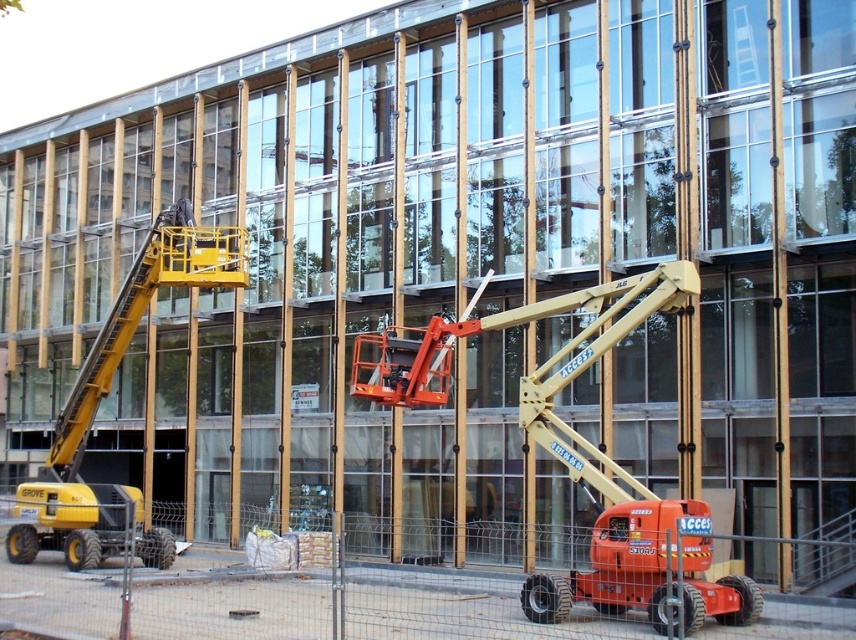
Question: Which of the following is the farthest from the observer?

Choices:
 (A) yellow metallic cherry picker at left
 (B) yellow rubber construction vehicle at lower left

Answer: (A)

Question: Can you confirm if orange metallic lift at center is positioned to the right of yellow metallic cherry picker at left?

Choices:
 (A) yes
 (B) no

Answer: (A)

Question: Is the position of yellow rubber construction vehicle at lower left less distant than that of orange metallic lift at center?

Choices:
 (A) yes
 (B) no

Answer: (A)

Question: Estimate the real-world distances between objects in this image. Which object is farther from the yellow rubber construction vehicle at lower left?

Choices:
 (A) orange metallic lift at center
 (B) yellow metallic cherry picker at left

Answer: (A)

Question: Which point appears farthest from the camera in this image?

Choices:
 (A) (114, 340)
 (B) (619, 608)
 (C) (783, 636)

Answer: (A)

Question: Does orange metallic lift at center have a larger size compared to yellow metallic cherry picker at left?

Choices:
 (A) yes
 (B) no

Answer: (B)